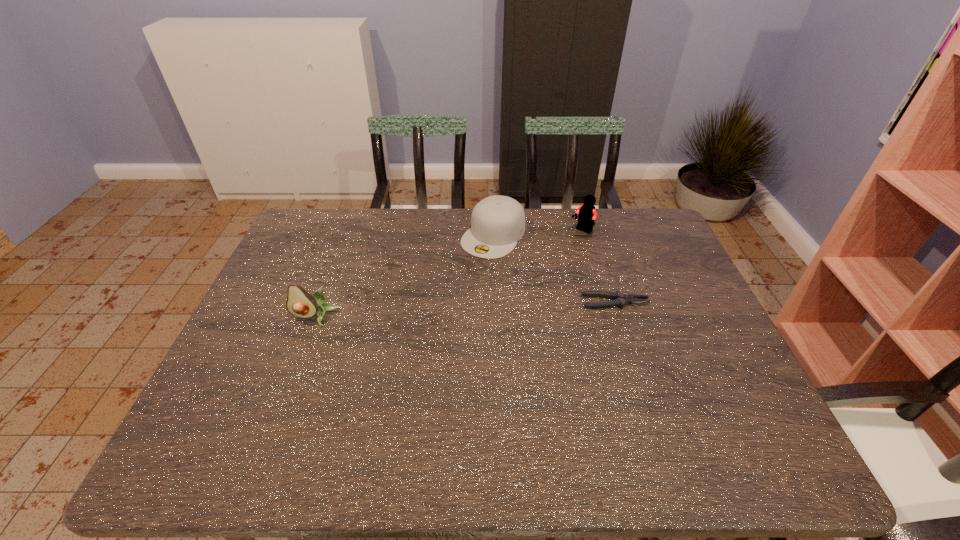
The image size is (960, 540). I want to click on vacant space at the far left corner of the desktop, so click(310, 218).

At what (x,y) coordinates should I click in order to perform the action: click on vacant area at the far right corner of the desktop. Please return your answer as a coordinate pair (x, y). Looking at the image, I should click on click(x=648, y=227).

Find the location of a particular element. This screenshot has width=960, height=540. free area in between the Lego and the cap is located at coordinates (538, 233).

You are a GUI agent. You are given a task and a screenshot of the screen. Output one action in this format:
    pyautogui.click(x=<x>, y=<y>)
    Task: Click on the free point between the third tallest object and the avocado
    
    Given the screenshot: What is the action you would take?
    pyautogui.click(x=404, y=276)

Locate an element on the screen. This screenshot has width=960, height=540. free space between the shortest object and the leftmost object is located at coordinates (466, 309).

Where is `free spot between the avocado and the shortest object`? free spot between the avocado and the shortest object is located at coordinates pos(466,309).

The image size is (960, 540). I want to click on free point between the second shortest object and the avocado, so click(404, 276).

Where is `vacant region between the avocado and the pliers`? The image size is (960, 540). vacant region between the avocado and the pliers is located at coordinates (466, 309).

The image size is (960, 540). I want to click on empty location between the pliers and the Lego, so click(x=598, y=267).

Locate an element on the screen. This screenshot has height=540, width=960. empty location between the pliers and the second object from left to right is located at coordinates (554, 268).